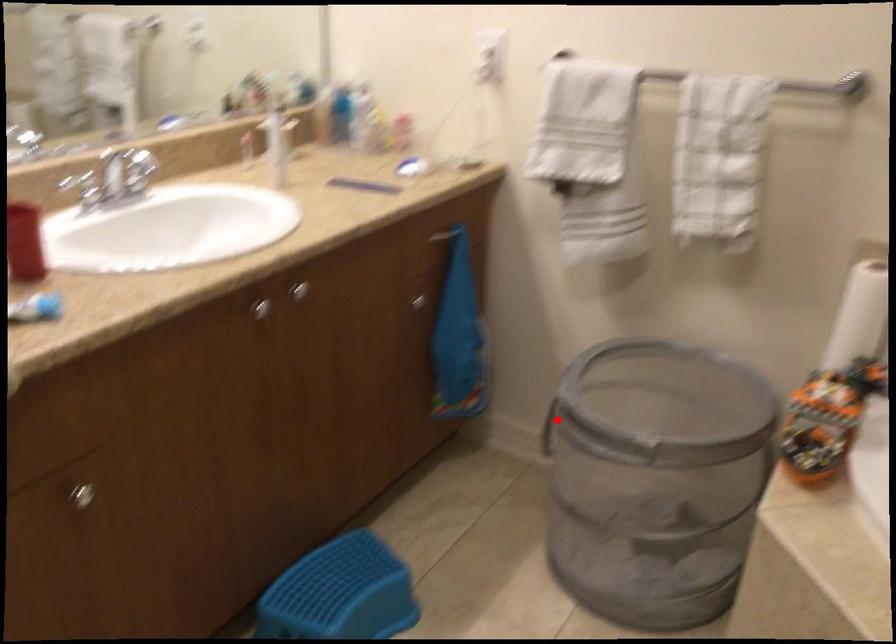
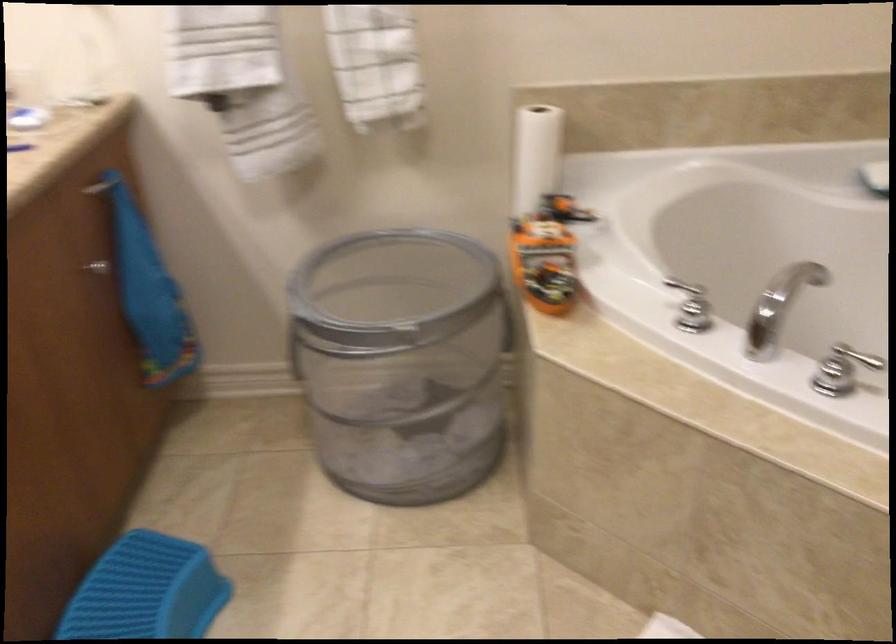
In the second image, find the point that corresponds to the highlighted location in the first image.

(303, 341)